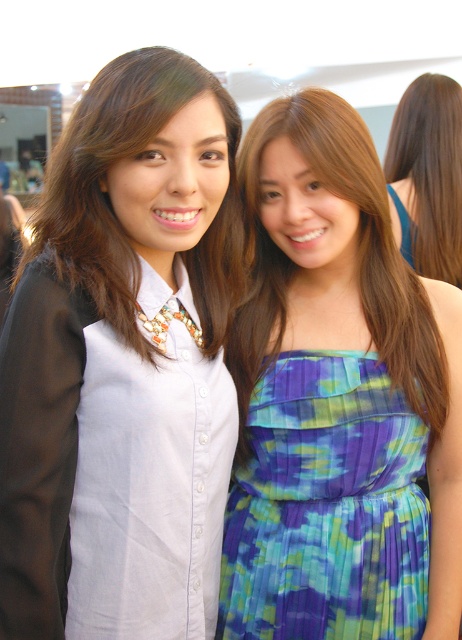
Which of these two, white glossy shirt at center or brown hair at upper right, stands shorter?

brown hair at upper right is shorter.

Who is lower down, white glossy shirt at center or brown hair at upper right?

white glossy shirt at center

Describe the element at coordinates (123, 364) in the screenshot. I see `white glossy shirt at center` at that location.

Locate an element on the screen. This screenshot has height=640, width=462. white glossy shirt at center is located at coordinates (123, 364).

Which of these two, blue-green pleated dress at center or brown hair at upper right, stands taller?

brown hair at upper right

Between blue-green pleated dress at center and brown hair at upper right, which one is positioned lower?

Positioned lower is blue-green pleated dress at center.

Is point (316, 376) positioned after point (411, 209)?

No, (316, 376) is closer to viewer.

Find the location of a particular element. This screenshot has width=462, height=640. blue-green pleated dress at center is located at coordinates (327, 508).

Does point (38, 451) come in front of point (237, 541)?

Yes, point (38, 451) is in front of point (237, 541).

Which is behind, point (236, 275) or point (311, 371)?

The point (236, 275) is more distant.

Image resolution: width=462 pixels, height=640 pixels. In order to click on white glossy shirt at center in this screenshot , I will do `click(123, 364)`.

Find the location of `white glossy shirt at center`. white glossy shirt at center is located at coordinates (123, 364).